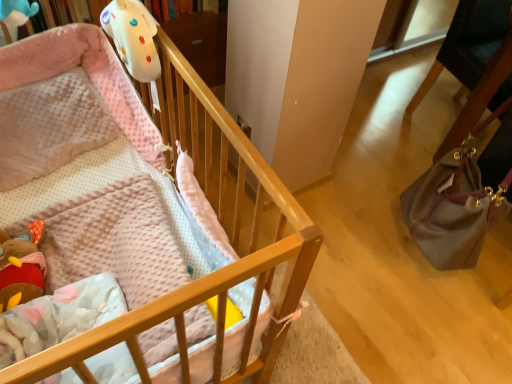
I want to click on matte brown handbag at right, so click(x=455, y=205).

In order to face matte brown handbag at right, should I rotate leftwards or rightwards?

You should look right and rotate roughly 28.457 degrees.

Image resolution: width=512 pixels, height=384 pixels. What do you see at coordinates (455, 205) in the screenshot?
I see `matte brown handbag at right` at bounding box center [455, 205].

Measure the distance between point (x=462, y=203) and camera.

Point (x=462, y=203) is 1.39 meters away from camera.

Where is `wooden crib at upper left`? The image size is (512, 384). wooden crib at upper left is located at coordinates (136, 217).

What do you see at coordinates (136, 217) in the screenshot? I see `wooden crib at upper left` at bounding box center [136, 217].

Measure the distance between wooden crib at upper left and camera.

The depth of wooden crib at upper left is 17.97 inches.

Image resolution: width=512 pixels, height=384 pixels. I want to click on matte brown handbag at right, so click(455, 205).

Which object is positioned more to the right, wooden crib at upper left or matte brown handbag at right?

matte brown handbag at right is more to the right.

Is wooden crib at upper left positioned behind matte brown handbag at right?

No, it is in front of matte brown handbag at right.

Is point (205, 102) closer or farther from the camera than point (468, 201)?

Point (205, 102).

From the image's perspective, does wooden crib at upper left appear lower than matte brown handbag at right?

Yes.

From the picture: From a real-world perspective, who is located lower, wooden crib at upper left or matte brown handbag at right?

wooden crib at upper left is physically lower.

Is wooden crib at upper left thinner than matte brown handbag at right?

No.

Can you confirm if wooden crib at upper left is taller than matte brown handbag at right?

Yes.

Considering the sizes of objects wooden crib at upper left and matte brown handbag at right in the image provided, who is bigger, wooden crib at upper left or matte brown handbag at right?

wooden crib at upper left.

Is matte brown handbag at right completely or partially inside wooden crib at upper left?

No, matte brown handbag at right is not inside wooden crib at upper left.

Would you consider wooden crib at upper left to be distant from matte brown handbag at right?

No.

Could you tell me if wooden crib at upper left is facing matte brown handbag at right?

No, wooden crib at upper left is not turned towards matte brown handbag at right.

How different are the orientations of wooden crib at upper left and matte brown handbag at right in degrees?

wooden crib at upper left and matte brown handbag at right are facing 122 degrees away from each other.

Where is `handbag behind the wooden crib at upper left`? This screenshot has height=384, width=512. handbag behind the wooden crib at upper left is located at coordinates (455, 205).

From the picture: Between matte brown handbag at right and wooden crib at upper left, which one appears on the left side from the viewer's perspective?

wooden crib at upper left is more to the left.

Relative to wooden crib at upper left, is matte brown handbag at right in front or behind?

Clearly, matte brown handbag at right is behind wooden crib at upper left.

Does point (414, 207) lie in front of point (82, 163)?

That is False.

From the image's perspective, would you say matte brown handbag at right is positioned over wooden crib at upper left?

Yes, from the image's perspective, matte brown handbag at right is above wooden crib at upper left.

From a real-world perspective, is matte brown handbag at right under wooden crib at upper left?

Incorrect, from a real-world perspective, matte brown handbag at right is higher than wooden crib at upper left.

Looking at their sizes, would you say matte brown handbag at right is wider or thinner than wooden crib at upper left?

Clearly, matte brown handbag at right has less width compared to wooden crib at upper left.

In terms of height, does matte brown handbag at right look taller or shorter compared to wooden crib at upper left?

Clearly, matte brown handbag at right is shorter compared to wooden crib at upper left.

Considering the sizes of objects matte brown handbag at right and wooden crib at upper left in the image provided, who is smaller, matte brown handbag at right or wooden crib at upper left?

Smaller between the two is matte brown handbag at right.

Is matte brown handbag at right situated inside wooden crib at upper left or outside?

The correct answer is: outside.

Can you see matte brown handbag at right touching wooden crib at upper left?

No, matte brown handbag at right is not with wooden crib at upper left.

Is matte brown handbag at right turned away from wooden crib at upper left?

matte brown handbag at right is not turned away from wooden crib at upper left.

How many degrees apart are the facing directions of matte brown handbag at right and wooden crib at upper left?

The angular difference between matte brown handbag at right and wooden crib at upper left is 122 degrees.

At what (x,y) coordinates should I click in order to perform the action: click on handbag behind the wooden crib at upper left. Please return your answer as a coordinate pair (x, y). This screenshot has height=384, width=512. Looking at the image, I should click on (455, 205).

You are a GUI agent. You are given a task and a screenshot of the screen. Output one action in this format:
    pyautogui.click(x=<x>, y=<y>)
    Task: Click on the handbag above the wooden crib at upper left (from the image's perspective)
    This screenshot has height=384, width=512.
    Given the screenshot: What is the action you would take?
    pyautogui.click(x=455, y=205)

Where is `infant bed below the matte brown handbag at right (from the image's perspective)`? This screenshot has height=384, width=512. infant bed below the matte brown handbag at right (from the image's perspective) is located at coordinates (136, 217).